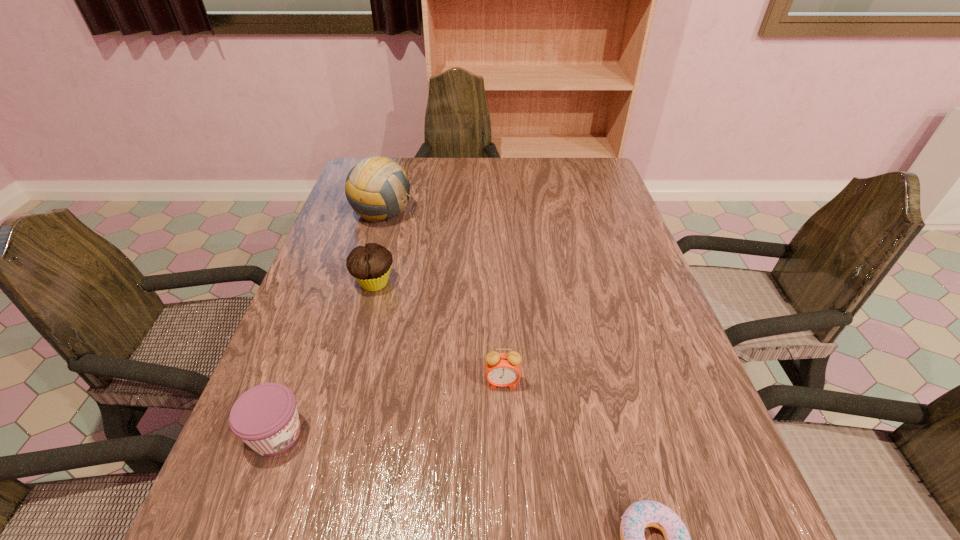
In order to click on empty space between the fourth object from left to right and the second nearest object in this screenshot , I will do `click(390, 408)`.

Identify which object is located as the nearest to the muffin. Please provide its 2D coordinates. Your answer should be formatted as a tuple, i.e. [(x, y)], where the tuple contains the x and y coordinates of a point satisfying the conditions above.

[(377, 188)]

Identify the location of object that can be found as the second closest to the tallest object. Image resolution: width=960 pixels, height=540 pixels. (501, 369).

Locate an element on the screen. free space that satisfies the following two spatial constraints: 1. on the face of the alarm clock; 2. on the front label of the fourth farthest object is located at coordinates (504, 434).

The width and height of the screenshot is (960, 540). I want to click on vacant space that satisfies the following two spatial constraints: 1. on the face of the third nearest object; 2. on the front label of the fourth tallest object, so click(504, 434).